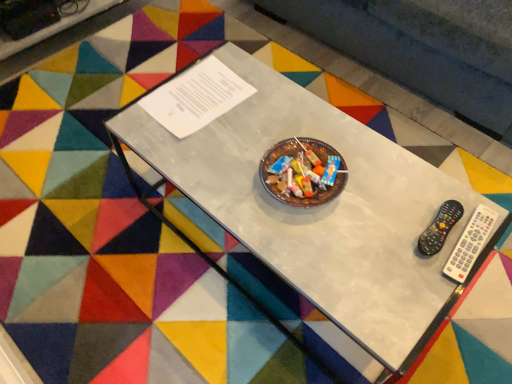
Where is `free location to the left of black plastic remote at right`? The image size is (512, 384). free location to the left of black plastic remote at right is located at coordinates (362, 233).